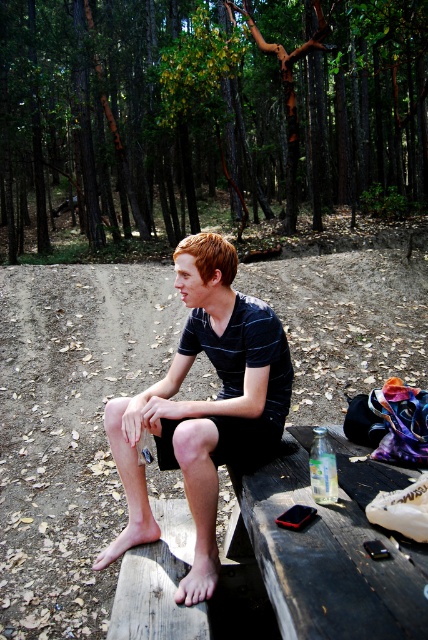
Is brown dirt track at center above wooden picnic table at center?

Actually, brown dirt track at center is below wooden picnic table at center.

Find the location of `brown dirt track at center`. brown dirt track at center is located at coordinates (70, 429).

Is point (32, 275) positioned behind point (265, 499)?

Yes.

I want to click on brown dirt track at center, so click(x=70, y=429).

Is point (124, 461) positioned before point (249, 525)?

No, it is behind (249, 525).

Is black striped shirt at center taller than wooden picnic table at center?

Yes.

Is point (216, 499) positioned after point (297, 637)?

Yes, it is behind point (297, 637).

In order to click on black striped shirt at center in this screenshot , I will do `click(204, 404)`.

Does brown bark trees at upper center have a larger size compared to wooden picnic table at center?

Correct, brown bark trees at upper center is larger in size than wooden picnic table at center.

Is brown bark trees at upper center closer to the viewer compared to wooden picnic table at center?

No, brown bark trees at upper center is behind wooden picnic table at center.

Which is in front, point (377, 168) or point (299, 570)?

Point (299, 570)

You are a GUI agent. You are given a task and a screenshot of the screen. Output one action in this format:
    pyautogui.click(x=<x>, y=<y>)
    Task: Click on the brown bark trees at upper center
    
    Given the screenshot: What is the action you would take?
    pyautogui.click(x=205, y=116)